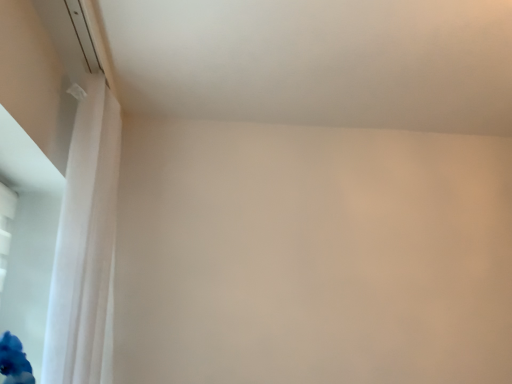
The width and height of the screenshot is (512, 384). What do you see at coordinates (29, 237) in the screenshot? I see `transparent plastic window screen at lower left` at bounding box center [29, 237].

Image resolution: width=512 pixels, height=384 pixels. Identify the location of transparent plastic window screen at lower left. (29, 237).

The image size is (512, 384). What do you see at coordinates (85, 243) in the screenshot?
I see `white sheer curtain at left` at bounding box center [85, 243].

Locate an element on the screen. white sheer curtain at left is located at coordinates 85,243.

At what (x,y) coordinates should I click in order to perform the action: click on transparent plastic window screen at lower left. Please return your answer as a coordinate pair (x, y). Looking at the image, I should click on (29, 237).

In the scene shown: In the image, is transparent plastic window screen at lower left on the left side or the right side of white sheer curtain at left?

transparent plastic window screen at lower left is positioned on white sheer curtain at left's left side.

Is transparent plastic window screen at lower left closer to the viewer compared to white sheer curtain at left?

No, transparent plastic window screen at lower left is further to the viewer.

Is point (21, 229) positioned after point (79, 379)?

Yes, point (21, 229) is farther from viewer.

From the image's perspective, which one is positioned higher, transparent plastic window screen at lower left or white sheer curtain at left?

From the image's view, white sheer curtain at left is above.

From the picture: From a real-world perspective, is transparent plastic window screen at lower left above or below white sheer curtain at left?

Clearly, from a real-world perspective, transparent plastic window screen at lower left is below white sheer curtain at left.

Is transparent plastic window screen at lower left wider or thinner than white sheer curtain at left?

Clearly, transparent plastic window screen at lower left has less width compared to white sheer curtain at left.

Can you confirm if transparent plastic window screen at lower left is shorter than white sheer curtain at left?

Yes, transparent plastic window screen at lower left is shorter than white sheer curtain at left.

Between transparent plastic window screen at lower left and white sheer curtain at left, which one has smaller size?

With smaller size is transparent plastic window screen at lower left.

Is white sheer curtain at left a part of transparent plastic window screen at lower left?

Definitely not — white sheer curtain at left is not inside transparent plastic window screen at lower left.

Are transparent plastic window screen at lower left and white sheer curtain at left making contact?

No, transparent plastic window screen at lower left is not next to white sheer curtain at left.

Could you tell me if transparent plastic window screen at lower left is facing white sheer curtain at left?

No, transparent plastic window screen at lower left is not oriented towards white sheer curtain at left.

Where is `window screen on the left side of white sheer curtain at left`? This screenshot has width=512, height=384. window screen on the left side of white sheer curtain at left is located at coordinates (29, 237).

Can you confirm if white sheer curtain at left is positioned to the left of transparent plastic window screen at lower left?

In fact, white sheer curtain at left is to the right of transparent plastic window screen at lower left.

Is white sheer curtain at left positioned in front of transparent plastic window screen at lower left?

Yes, the depth of white sheer curtain at left is less than that of transparent plastic window screen at lower left.

Between point (69, 372) and point (20, 228), which one is positioned in front?

The point (69, 372) is closer to the camera.

From the image's perspective, which one is positioned higher, white sheer curtain at left or transparent plastic window screen at lower left?

white sheer curtain at left appears higher in the image.

From the picture: From a real-world perspective, is white sheer curtain at left physically located above or below transparent plastic window screen at lower left?

white sheer curtain at left is situated higher than transparent plastic window screen at lower left in the real world.

Considering the sizes of white sheer curtain at left and transparent plastic window screen at lower left in the image, is white sheer curtain at left wider or thinner than transparent plastic window screen at lower left?

Considering their sizes, white sheer curtain at left looks broader than transparent plastic window screen at lower left.

Is white sheer curtain at left taller than transparent plastic window screen at lower left?

Yes, white sheer curtain at left is taller than transparent plastic window screen at lower left.

Considering the relative sizes of white sheer curtain at left and transparent plastic window screen at lower left in the image provided, is white sheer curtain at left bigger than transparent plastic window screen at lower left?

Correct, white sheer curtain at left is larger in size than transparent plastic window screen at lower left.

Do you think white sheer curtain at left is within transparent plastic window screen at lower left, or outside of it?

white sheer curtain at left exists outside the volume of transparent plastic window screen at lower left.

Is white sheer curtain at left touching transparent plastic window screen at lower left?

No, white sheer curtain at left is not beside transparent plastic window screen at lower left.

In the scene shown: Is white sheer curtain at left facing away from transparent plastic window screen at lower left?

Yes, white sheer curtain at left is facing away from transparent plastic window screen at lower left.

How different are the orientations of white sheer curtain at left and transparent plastic window screen at lower left in degrees?

The facing directions of white sheer curtain at left and transparent plastic window screen at lower left are 89.8 degrees apart.

Looking at this image, how far apart are white sheer curtain at left and transparent plastic window screen at lower left?

They are 26.24 centimeters apart.

Where is `curtain lying in front of the transparent plastic window screen at lower left`? curtain lying in front of the transparent plastic window screen at lower left is located at coordinates (85, 243).

Identify the location of window screen beneath the white sheer curtain at left (from a real-world perspective). The height and width of the screenshot is (384, 512). (29, 237).

You are a GUI agent. You are given a task and a screenshot of the screen. Output one action in this format:
    pyautogui.click(x=<x>, y=<y>)
    Task: Click on the curtain that is on the right side of transparent plastic window screen at lower left
    The image size is (512, 384).
    Given the screenshot: What is the action you would take?
    pyautogui.click(x=85, y=243)